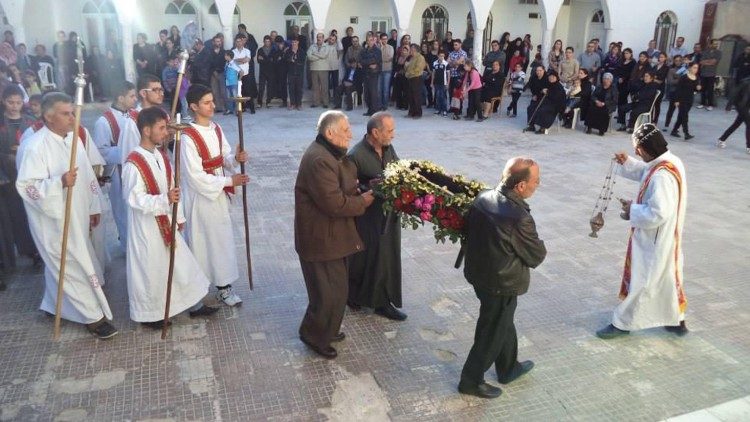
This screenshot has width=750, height=422. Identify the location of floor. (250, 361).